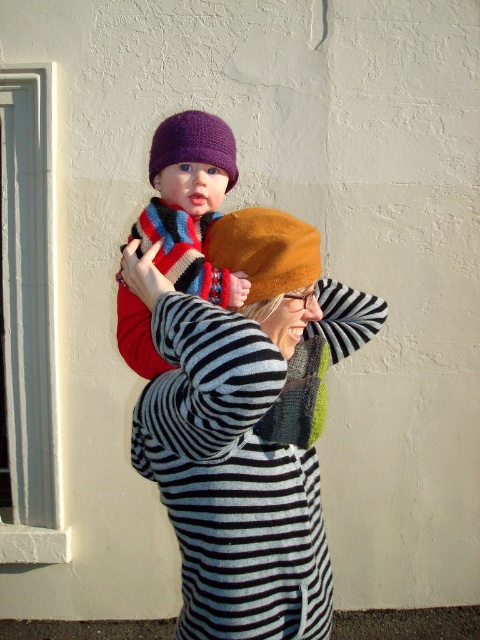
Question: Does knitted woolen hat at upper center appear over purple crocheted hat at upper center?

Choices:
 (A) yes
 (B) no

Answer: (B)

Question: Which of these objects is positioned farthest from the brown felt beret at center?

Choices:
 (A) knitted woolen hat at upper center
 (B) purple crocheted hat at upper center
 (C) knitted wool scarf at upper center
 (D) green knitted scarf at center

Answer: (B)

Question: Is striped knit sweater at center positioned behind purple crocheted hat at upper center?

Choices:
 (A) yes
 (B) no

Answer: (B)

Question: Based on their relative distances, which object is nearer to the green knitted scarf at center?

Choices:
 (A) brown felt beret at center
 (B) striped knit sweater at center
 (C) knitted wool scarf at upper center
 (D) knitted woolen hat at upper center

Answer: (B)

Question: Estimate the real-world distances between objects in this image. Which object is farther from the green knitted scarf at center?

Choices:
 (A) striped knit sweater at center
 (B) purple crocheted hat at upper center
 (C) knitted wool scarf at upper center
 (D) brown felt beret at center

Answer: (B)

Question: Does brown felt beret at center come in front of purple crocheted hat at upper center?

Choices:
 (A) yes
 (B) no

Answer: (A)